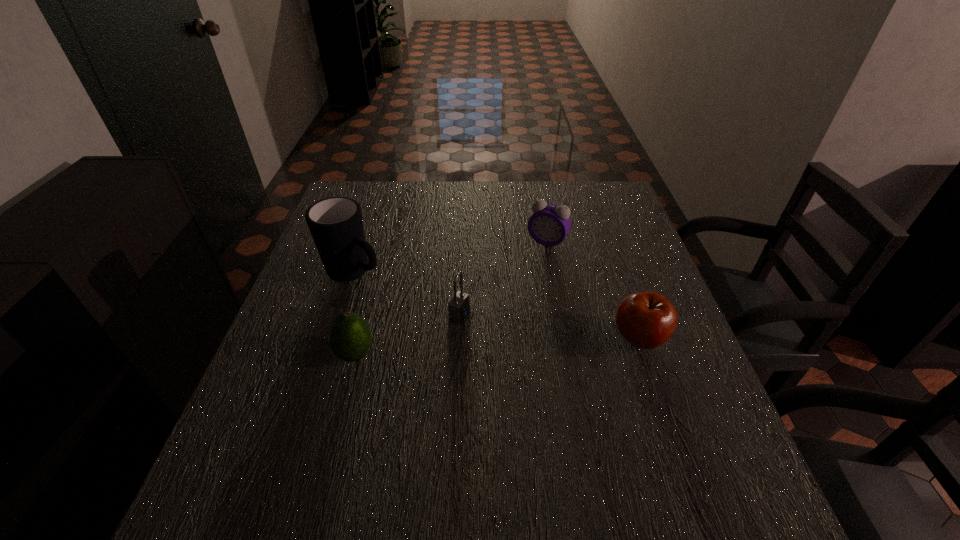
Image resolution: width=960 pixels, height=540 pixels. What are the coordinates of `avocado` in the screenshot? It's located at (350, 338).

Image resolution: width=960 pixels, height=540 pixels. In order to click on the rightmost object in this screenshot , I will do `click(647, 320)`.

Locate an element on the screen. the fourth nearest object is located at coordinates (336, 224).

Locate an element on the screen. Image resolution: width=960 pixels, height=540 pixels. mug is located at coordinates (336, 224).

Where is `the fourth object from left to right`? The image size is (960, 540). the fourth object from left to right is located at coordinates (549, 224).

Where is `alarm clock`? This screenshot has width=960, height=540. alarm clock is located at coordinates (549, 224).

Locate an element on the screen. This screenshot has height=540, width=960. the third object from left to right is located at coordinates (459, 306).

The height and width of the screenshot is (540, 960). I want to click on free point located on the right of the avocado, so click(471, 355).

The height and width of the screenshot is (540, 960). I want to click on vacant area located on the front of the rightmost object, so tap(680, 458).

The height and width of the screenshot is (540, 960). Find the location of `vacant area situated 0.100m on the side of the second farthest object with the handle`. vacant area situated 0.100m on the side of the second farthest object with the handle is located at coordinates (406, 300).